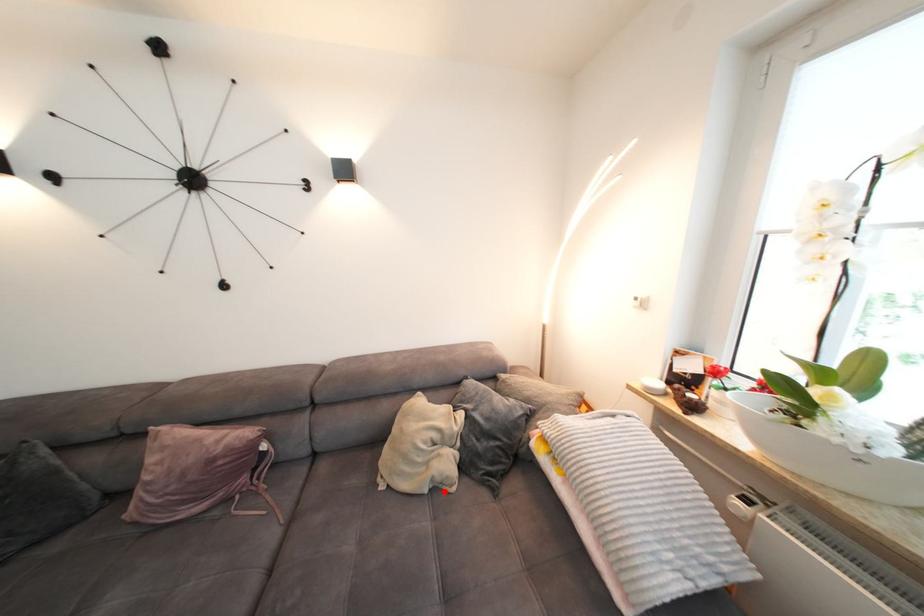
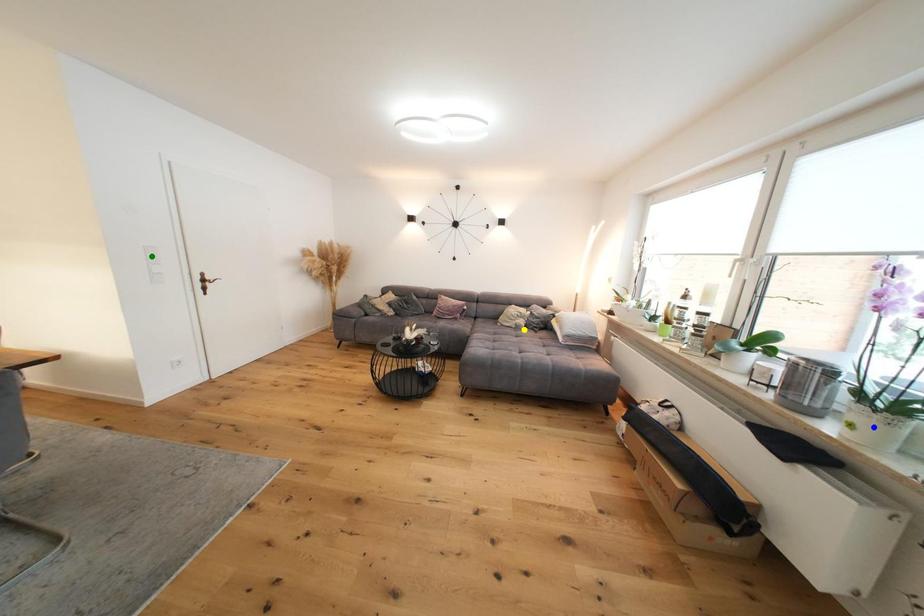
Question: I am providing you with two images of the same scene from different viewpoints. A red point is marked on the first image. You are given multiple points on the second image. Which point in image 2 is actually the same real-world point as the red point in image 1?

Choices:
 (A) yellow point
 (B) green point
 (C) blue point

Answer: (A)